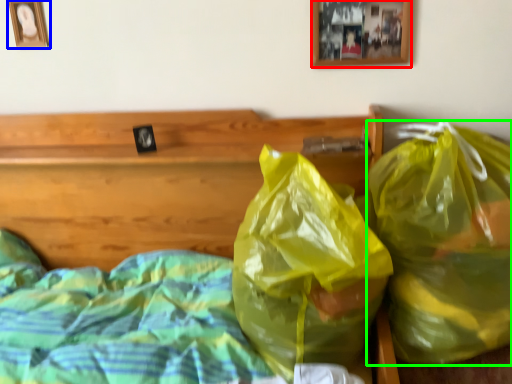
Question: Which object is the farthest from picture frame (highlighted by a red box)? Choose among these: picture frame (highlighted by a blue box) or plastic bag (highlighted by a green box).

Choices:
 (A) picture frame
 (B) plastic bag

Answer: (A)